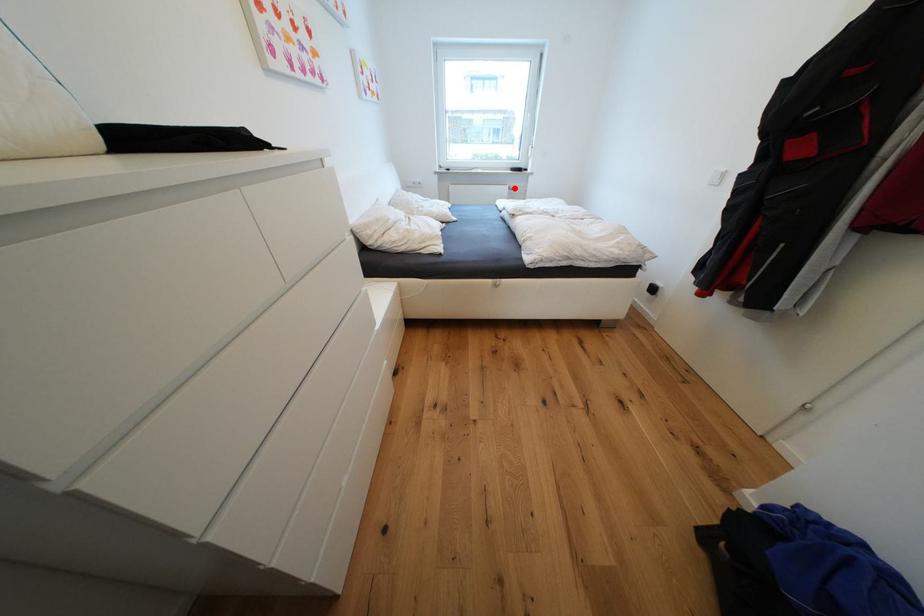
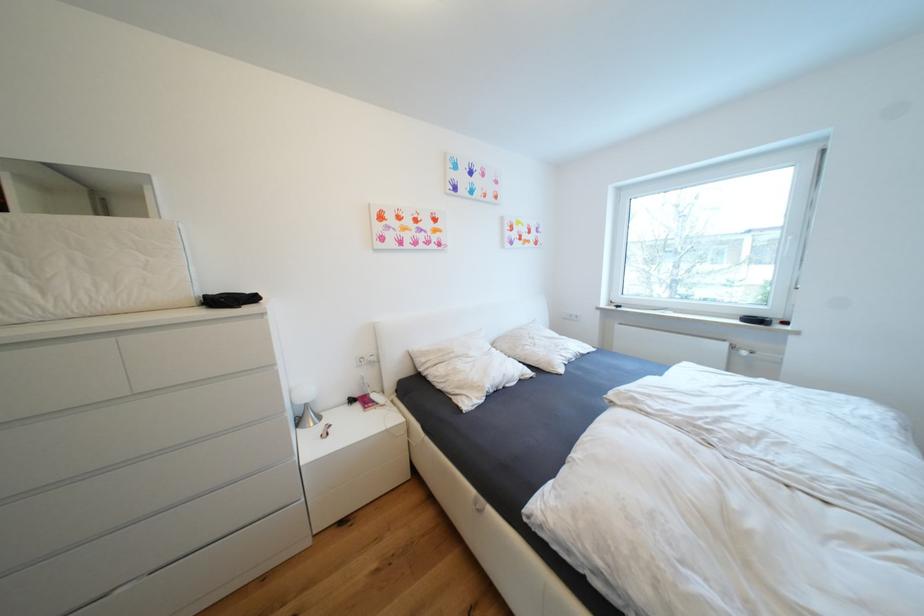
The point at the highlighted location is marked in the first image. Where is the corresponding point in the second image?

(733, 346)